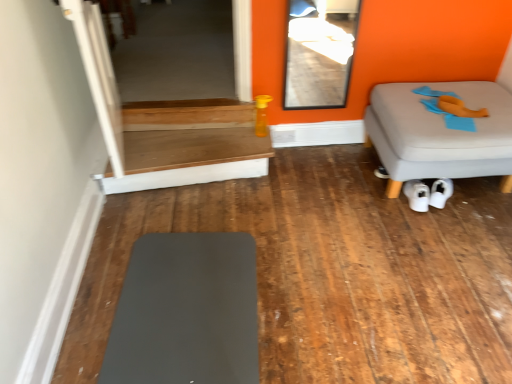
Locate an element on the screen. vacant space in between matte gray mat at lower left, marked as the second furniture in a right-to-left arrangement, and white matte sneakers at lower center is located at coordinates (330, 255).